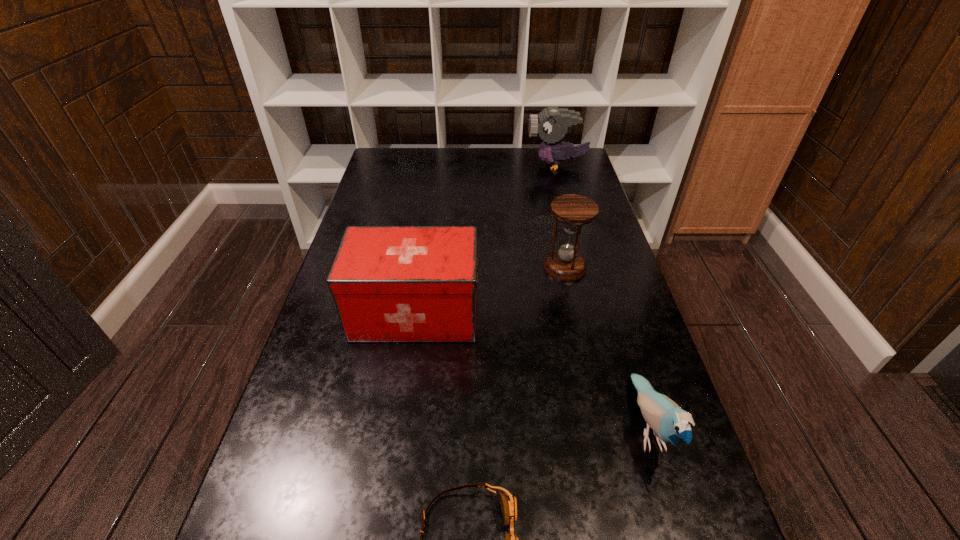
Where is `the farther bird`? The width and height of the screenshot is (960, 540). the farther bird is located at coordinates [x=551, y=124].

You are a GUI agent. You are given a task and a screenshot of the screen. Output one action in this format:
    pyautogui.click(x=<x>, y=<y>)
    Task: Click on the hourglass
    The height and width of the screenshot is (540, 960).
    Given the screenshot: What is the action you would take?
    pyautogui.click(x=565, y=264)

This screenshot has height=540, width=960. What are the coordinates of `the third farthest object` in the screenshot? It's located at (389, 283).

You are a GUI agent. You are given a task and a screenshot of the screen. Output one action in this format:
    pyautogui.click(x=<x>, y=<y>)
    Task: Click on the fourth farthest object
    Image resolution: width=960 pixels, height=540 pixels.
    Given the screenshot: What is the action you would take?
    pyautogui.click(x=670, y=424)

Identify the location of the nearer bird. (670, 424).

Where is `free space located at the beak of the farther bird`? free space located at the beak of the farther bird is located at coordinates (464, 165).

The height and width of the screenshot is (540, 960). In order to click on free region located at the beak of the farther bird in this screenshot , I will do `click(435, 165)`.

At what (x,y) coordinates should I click in order to perform the action: click on vacant region located 0.050m at the beak of the farther bird. Please return your answer as a coordinate pair (x, y). This screenshot has width=960, height=540. Looking at the image, I should click on (514, 165).

You are a GUI agent. You are given a task and a screenshot of the screen. Output one action in this format:
    pyautogui.click(x=<x>, y=<y>)
    Task: Click on the vacant space located on the right of the fourth nearest object
    
    Given the screenshot: What is the action you would take?
    [608, 267]

Identify the location of blank space located on the handle side of the first-aid kit. The height and width of the screenshot is (540, 960). (499, 313).